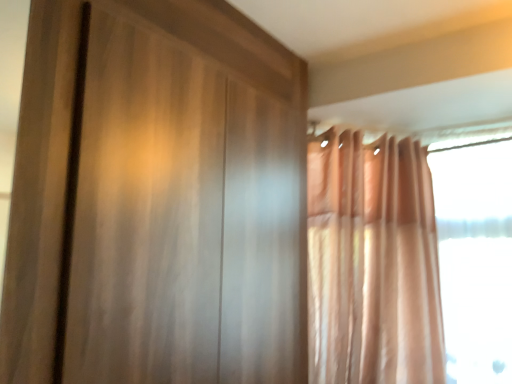
The height and width of the screenshot is (384, 512). I want to click on transparent glass window at right, so click(475, 252).

What do you see at coordinates (475, 252) in the screenshot? I see `transparent glass window at right` at bounding box center [475, 252].

This screenshot has height=384, width=512. I want to click on transparent glass window at right, so click(475, 252).